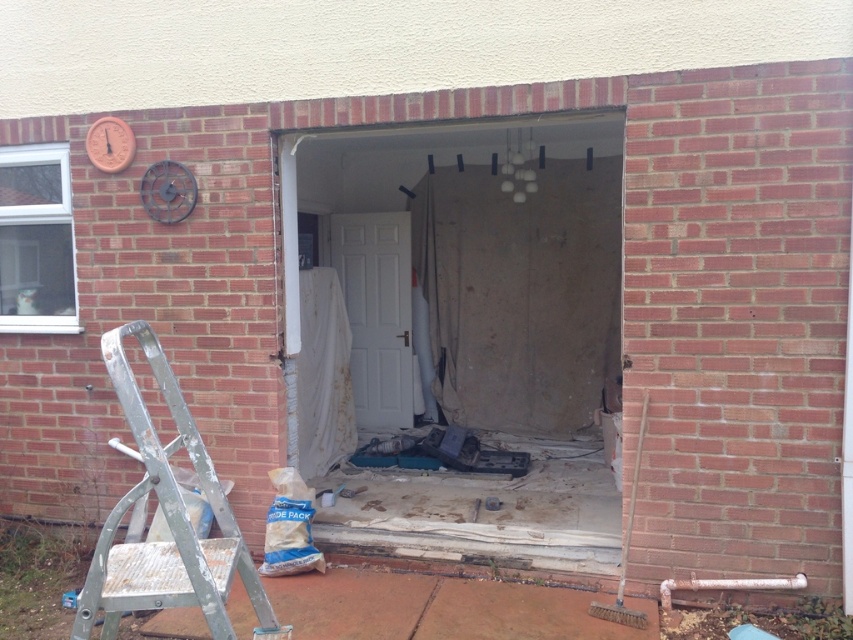
Question: Is silver metallic ladder at left to the left of white matte door at center from the viewer's perspective?

Choices:
 (A) yes
 (B) no

Answer: (A)

Question: Does silver metallic ladder at left appear on the right side of white matte door at center?

Choices:
 (A) no
 (B) yes

Answer: (A)

Question: Where is silver metallic ladder at left located in relation to white matte door at center in the image?

Choices:
 (A) right
 (B) left

Answer: (B)